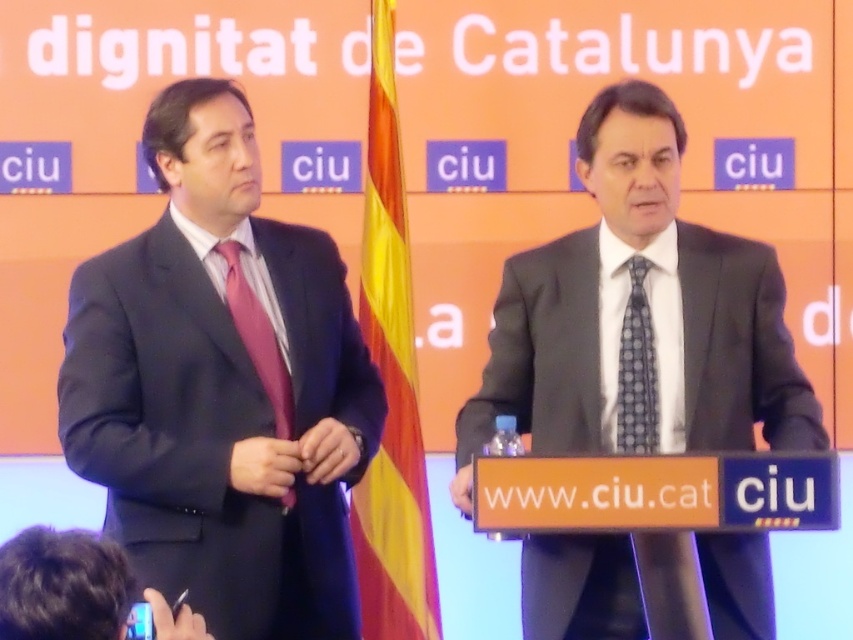
You are attending a press conference in Catalonia and notice two items of clothing. The first is the matte black suit at left, and the second is the blue dotted tie at center. Based on their positions in the image, which item is positioned lower?

The matte black suit at left is positioned lower than the blue dotted tie at center according to the description.